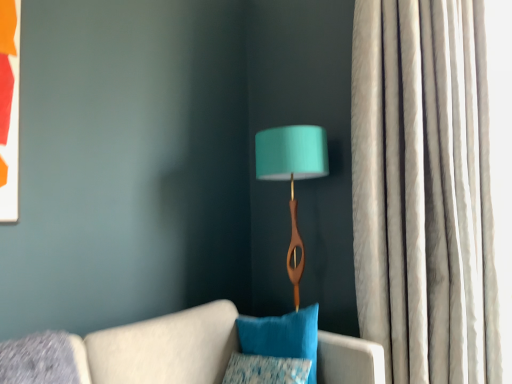
Question: Is velvety blue pillow at center, the 2th pillow positioned from the bottom, wider or thinner than teal fabric lampshade at center?

Choices:
 (A) thin
 (B) wide

Answer: (A)

Question: Is velvety blue pillow at center, placed as the 1th pillow when sorted from top to bottom, situated inside teal fabric lampshade at center or outside?

Choices:
 (A) inside
 (B) outside

Answer: (B)

Question: Based on their relative distances, which object is nearer to the teal fabric lampshade at center?

Choices:
 (A) textured blue pillow at lower center, placed as the first pillow when sorted from bottom to top
 (B) velvety blue pillow at center, the 2th pillow positioned from the bottom
 (C) silky white curtain at right

Answer: (B)

Question: Which of these objects is positioned closest to the velvety blue pillow at center, placed as the 1th pillow when sorted from top to bottom?

Choices:
 (A) teal fabric lampshade at center
 (B) textured blue pillow at lower center, the second pillow from the top
 (C) silky white curtain at right

Answer: (B)